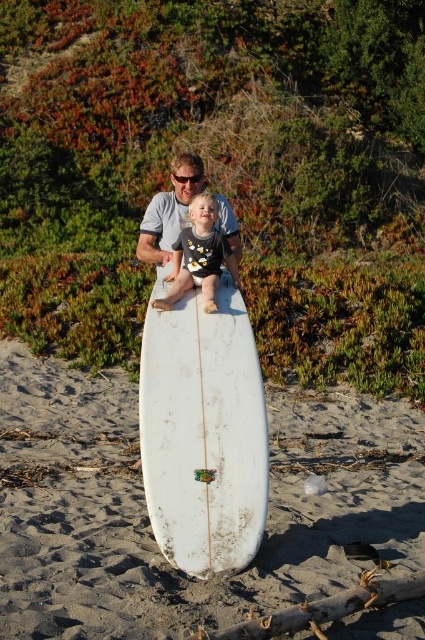
You are a photographer standing on the beach and want to take a photo of the white sand at center and the matte gray shirt at center. If your camera has a maximum focus range of 10 feet, will both subjects be in focus?

The white sand at center and matte gray shirt at center are 10.98 feet apart from each other. Since the distance exceeds the camera maximum focus range of 10 feet, both subjects cannot be in focus at the same time.

You are standing on the beach and see two points marked in the image. Which point is closer to you, point (201,257) or point (180,198)?

Point (201,257) is in front of point (180,198), so it is closer to you.

You are standing on the beach and want to take a photo of the white sand at center and the matte gray shirt at center. Which object is positioned closer to the camera?

The white sand at center is closer to the viewer than the matte gray shirt at center, so it will appear closer in the photo.